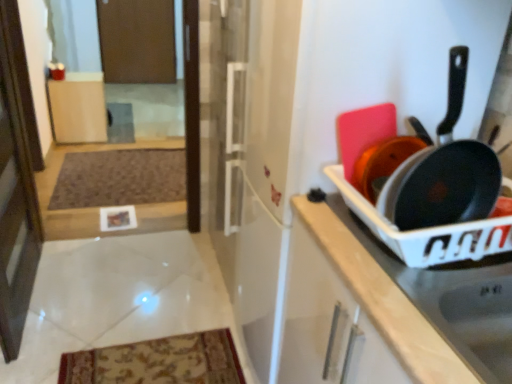
Question: Should I look upward or downward to see matte wood cabinet at center, which is the first cabinetry from left to right?

Choices:
 (A) down
 (B) up

Answer: (B)

Question: In which direction should I rotate to look at brown matte screen door at upper center, which ranks as the second screen door in front-to-back order?

Choices:
 (A) right
 (B) left

Answer: (B)

Question: Considering the relative positions of brown matte screen door at upper center, which ranks as the second screen door in front-to-back order, and brown textured mat at lower left in the image provided, is brown matte screen door at upper center, which ranks as the second screen door in front-to-back order, in front of brown textured mat at lower left?

Choices:
 (A) yes
 (B) no

Answer: (B)

Question: From a real-world perspective, does brown matte screen door at upper center, marked as the 1th screen door in a back-to-front arrangement, stand above brown textured mat at lower left?

Choices:
 (A) yes
 (B) no

Answer: (A)

Question: Is brown matte screen door at upper center, which is counted as the 2th screen door, starting from the bottom, thinner than brown textured mat at lower left?

Choices:
 (A) yes
 (B) no

Answer: (A)

Question: Is brown matte screen door at upper center, the first screen door from the top, shorter than brown textured mat at lower left?

Choices:
 (A) yes
 (B) no

Answer: (B)

Question: From a real-world perspective, is brown matte screen door at upper center, which is counted as the 2th screen door, starting from the bottom, physically below brown textured mat at lower left?

Choices:
 (A) no
 (B) yes

Answer: (A)

Question: Does brown matte screen door at upper center, which ranks as the second screen door in front-to-back order, contain brown textured mat at lower left?

Choices:
 (A) yes
 (B) no

Answer: (B)

Question: Is matte black frying pan at right touching white plastic tray at right, arranged as the second cabinetry when viewed from the top?

Choices:
 (A) yes
 (B) no

Answer: (B)

Question: Can you confirm if matte black frying pan at right is taller than white plastic tray at right, which is the second cabinetry in left-to-right order?

Choices:
 (A) yes
 (B) no

Answer: (A)

Question: From the image's perspective, is matte black frying pan at right beneath white plastic tray at right, marked as the first cabinetry in a bottom-to-top arrangement?

Choices:
 (A) yes
 (B) no

Answer: (B)

Question: Does matte black frying pan at right have a greater width compared to white plastic tray at right, which is the second cabinetry in left-to-right order?

Choices:
 (A) no
 (B) yes

Answer: (A)

Question: Can you confirm if matte black frying pan at right is positioned to the right of white plastic tray at right, which is counted as the first cabinetry, starting from the right?

Choices:
 (A) no
 (B) yes

Answer: (A)

Question: From a real-world perspective, is matte black frying pan at right located higher than white plastic tray at right, arranged as the first cabinetry when viewed from the front?

Choices:
 (A) no
 (B) yes

Answer: (B)

Question: Would you say matte wood cabinet at center, which is the first cabinetry from left to right, is part of brown textured mat at lower left's contents?

Choices:
 (A) yes
 (B) no

Answer: (B)